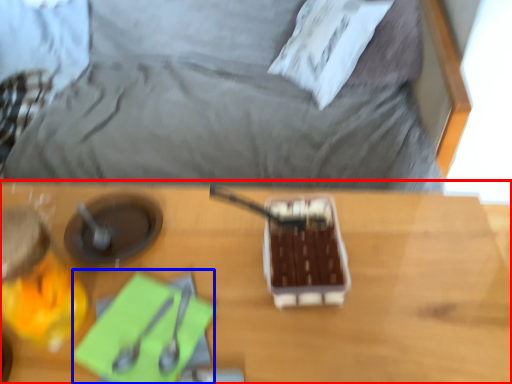
Question: Among these objects, which one is nearest to the camera, table (highlighted by a red box) or notepad (highlighted by a blue box)?

Choices:
 (A) table
 (B) notepad

Answer: (A)